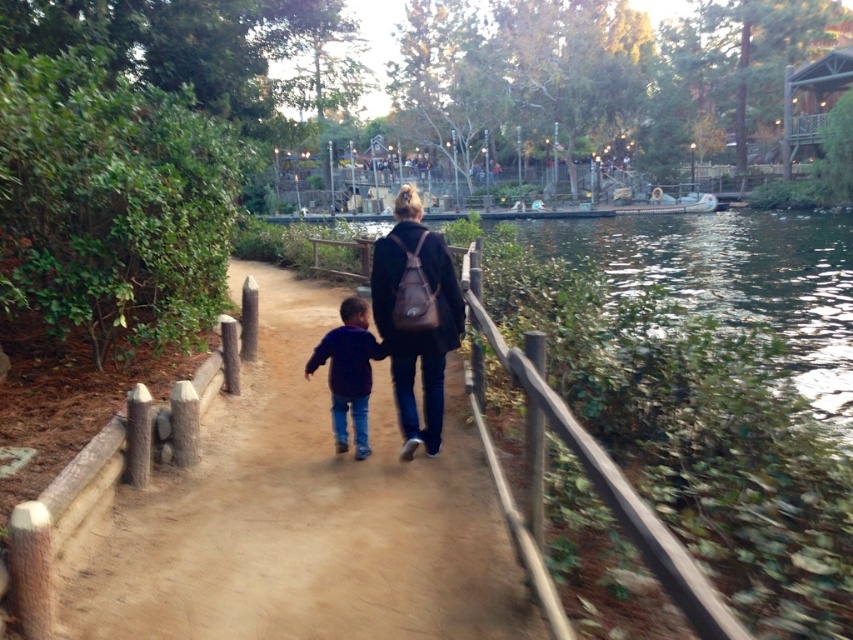
You are standing at the point marked as point (303, 516) in the image. What is the name of the object you are currently standing on?

The point (303, 516) corresponds to the dirt path at center, so you are standing on the dirt path at center.

You are a hiker planning to cross the dirt path at center. You notice there is greenish water at center nearby. Based on the terrain, which one is lower in elevation?

The dirt path at center has a lesser height compared to greenish water at center, so the dirt path at center is lower in elevation.

Consider the image. You are a hiker planning to walk along the dirt path at center while wearing a dark blue fleece at center. Considering the length of both the path and your clothing, which one is shorter?

The dirt path at center is shorter than the dark blue fleece at center, so the path is shorter than the fleece.